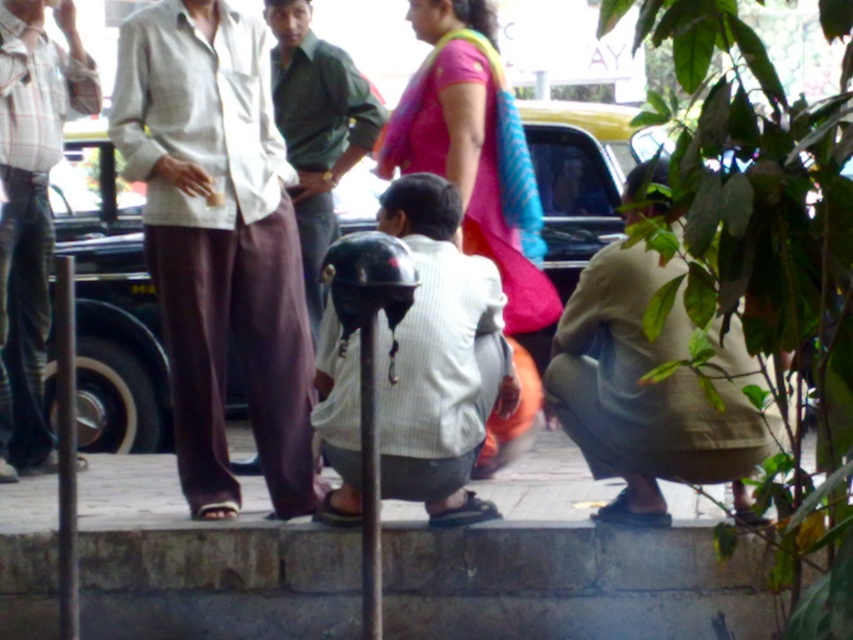
Question: Which object is positioned closest to the khaki cotton pants at lower right?

Choices:
 (A) plaid cotton shirt at left
 (B) white striped shirt at center
 (C) light brown cotton pants at center
 (D) gray stone curb at lower center

Answer: (B)

Question: Among these objects, which one is farthest from the camera?

Choices:
 (A) khaki cotton pants at lower right
 (B) pink fabric sari at center
 (C) plaid cotton shirt at left
 (D) white striped shirt at center

Answer: (C)

Question: Does light brown cotton pants at center have a greater width compared to green fabric shirt at center?

Choices:
 (A) no
 (B) yes

Answer: (B)

Question: Is pink fabric sari at center above plaid cotton shirt at left?

Choices:
 (A) yes
 (B) no

Answer: (B)

Question: Can you confirm if light brown cotton pants at center is wider than white striped shirt at center?

Choices:
 (A) yes
 (B) no

Answer: (A)

Question: Which is nearer to the pink fabric sari at center?

Choices:
 (A) plaid cotton shirt at left
 (B) khaki cotton pants at lower right

Answer: (B)